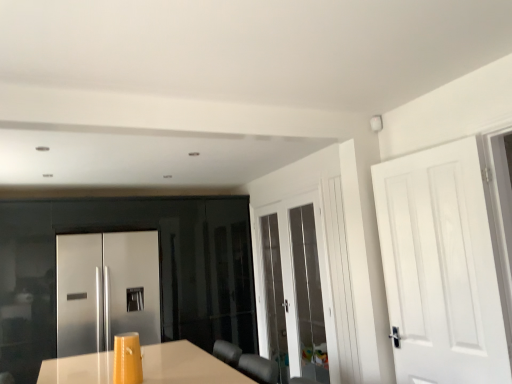
Question: From a real-world perspective, does white glossy door at center, the second door positioned from the left, stand above white matte door at right, which is the third door from back to front?

Choices:
 (A) no
 (B) yes

Answer: (A)

Question: Does white glossy door at center, which is counted as the second door, starting from the back, have a lesser height compared to white matte door at right, arranged as the 3th door when viewed from the left?

Choices:
 (A) no
 (B) yes

Answer: (A)

Question: Could you tell me if white glossy door at center, the second door positioned from the left, is turned towards white matte door at right, which is counted as the first door, starting from the right?

Choices:
 (A) yes
 (B) no

Answer: (B)

Question: Is white glossy door at center, which is counted as the second door, starting from the back, looking in the opposite direction of white matte door at right, which is the third door from back to front?

Choices:
 (A) no
 (B) yes

Answer: (A)

Question: Is white glossy door at center, the second door from the front, bigger than white matte door at right, acting as the 1th door starting from the front?

Choices:
 (A) yes
 (B) no

Answer: (A)

Question: From the image's perspective, is white glossy door at center, the 2th door when ordered from right to left, above or below satin stainless steel refrigerator at center, which is the third door in front-to-back order?

Choices:
 (A) below
 (B) above

Answer: (B)

Question: Relative to satin stainless steel refrigerator at center, placed as the first door when sorted from back to front, is white glossy door at center, the 2th door when ordered from right to left, in front or behind?

Choices:
 (A) behind
 (B) front

Answer: (B)

Question: Based on their positions, is white glossy door at center, the 2th door when ordered from right to left, located to the left or right of satin stainless steel refrigerator at center, placed as the first door when sorted from back to front?

Choices:
 (A) right
 (B) left

Answer: (A)

Question: Is white glossy door at center, the 2th door when ordered from right to left, taller or shorter than satin stainless steel refrigerator at center, which ranks as the 1th door in left-to-right order?

Choices:
 (A) short
 (B) tall

Answer: (B)

Question: From the image's perspective, is satin stainless steel refrigerator at center, placed as the first door when sorted from back to front, above or below white glossy door at center, the second door positioned from the left?

Choices:
 (A) below
 (B) above

Answer: (A)

Question: Considering the positions of satin stainless steel refrigerator at center, which ranks as the 1th door in left-to-right order, and white glossy door at center, the second door positioned from the left, in the image, is satin stainless steel refrigerator at center, which ranks as the 1th door in left-to-right order, taller or shorter than white glossy door at center, the second door positioned from the left,?

Choices:
 (A) tall
 (B) short

Answer: (B)

Question: From a real-world perspective, is satin stainless steel refrigerator at center, which ranks as the 1th door in left-to-right order, positioned above or below white glossy door at center, the second door positioned from the left?

Choices:
 (A) below
 (B) above

Answer: (A)

Question: In the image, is satin stainless steel refrigerator at center, which is the third door in front-to-back order, positioned in front of or behind white glossy door at center, which is counted as the second door, starting from the back?

Choices:
 (A) front
 (B) behind

Answer: (B)

Question: Is white matte door at right, arranged as the 3th door when viewed from the left, in front of or behind satin stainless steel refrigerator at center, which ranks as the 1th door in left-to-right order, in the image?

Choices:
 (A) behind
 (B) front

Answer: (B)

Question: In terms of width, does white matte door at right, arranged as the 3th door when viewed from the left, look wider or thinner when compared to satin stainless steel refrigerator at center, which is the third door in front-to-back order?

Choices:
 (A) wide
 (B) thin

Answer: (B)